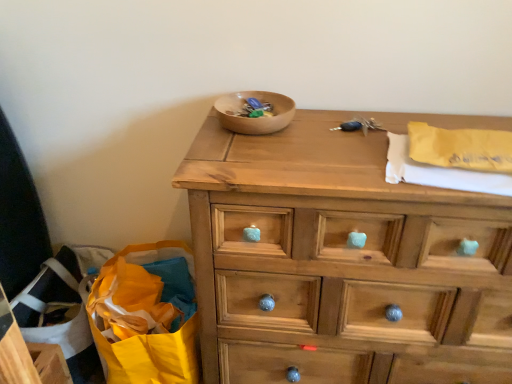
Locate an element on the screen. free point above yellow paper at upper right (from a real-world perspective) is located at coordinates (461, 162).